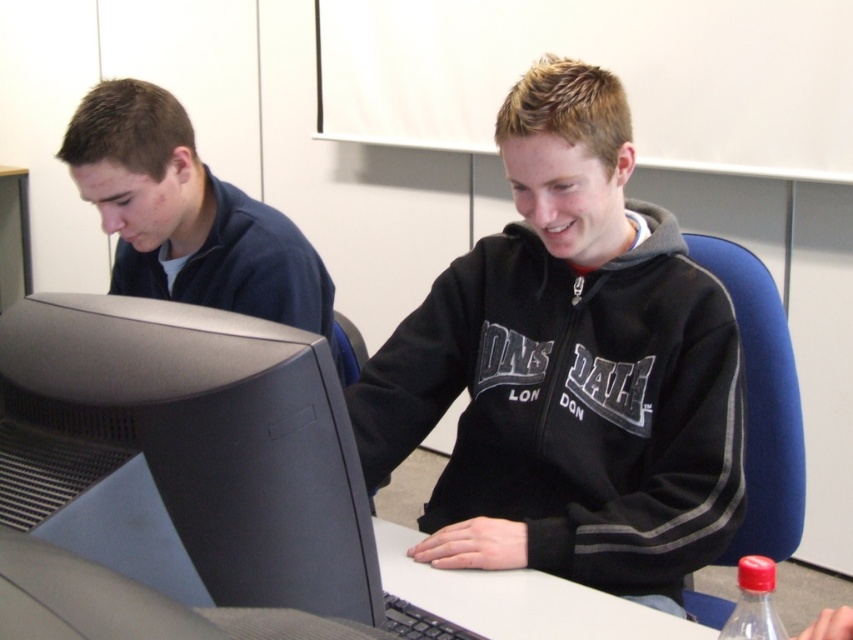
Based on the photo, who is positioned more to the left, black fleece sweatshirt at center or red plastic bottle at lower right?

Positioned to the left is black fleece sweatshirt at center.

Between black fleece sweatshirt at center and red plastic bottle at lower right, which one is positioned lower?

red plastic bottle at lower right

Is point (421, 369) positioned after point (769, 621)?

Yes, it is behind point (769, 621).

Locate an element on the screen. black fleece sweatshirt at center is located at coordinates (572, 404).

Is black matte computer monitor at left wider than matte blue shirt at left?

No.

Does black matte computer monitor at left appear on the left side of matte blue shirt at left?

Incorrect, black matte computer monitor at left is not on the left side of matte blue shirt at left.

I want to click on black matte computer monitor at left, so click(x=184, y=452).

In the scene shown: Is matte blue shirt at left shorter than red plastic bottle at lower right?

No, matte blue shirt at left is not shorter than red plastic bottle at lower right.

Who is more forward, (x=167, y=244) or (x=757, y=596)?

Positioned in front is point (x=757, y=596).

In the scene shown: Measure the distance between point (140, 225) and camera.

The distance of point (140, 225) from camera is 1.48 meters.

This screenshot has width=853, height=640. I want to click on matte blue shirt at left, so click(x=186, y=214).